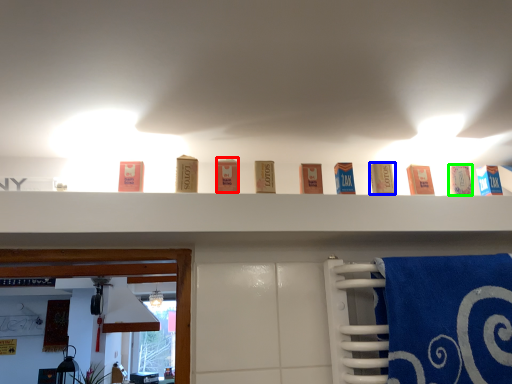
Question: Which object is positioned closest to product (highlighted by a red box)? Select from product (highlighted by a blue box) and product (highlighted by a green box).

Choices:
 (A) product
 (B) product

Answer: (A)